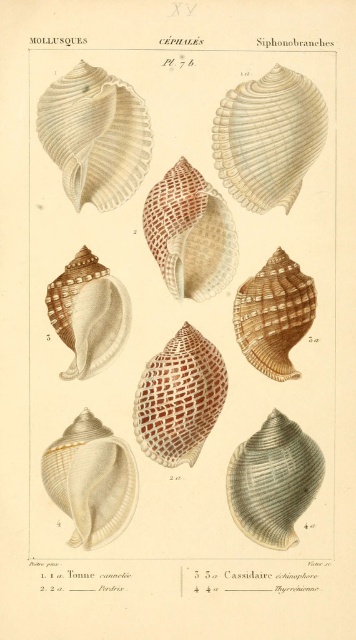
Question: Among these points, which one is nearest to the camera?

Choices:
 (A) (123, 292)
 (B) (274, 280)
 (C) (169, 376)
 (D) (306, 448)

Answer: (D)

Question: Is the position of brown woven shell at center more distant than that of matte brown shell at center-left?

Choices:
 (A) no
 (B) yes

Answer: (A)

Question: Does brown woven shell at center come behind matte beige shell at center-left?

Choices:
 (A) no
 (B) yes

Answer: (B)

Question: Among these objects, which one is nearest to the camera?

Choices:
 (A) brown textured shell at center
 (B) brown textured shell at upper center

Answer: (B)

Question: Which point is closer to the camera?

Choices:
 (A) matte brown shell at upper left
 (B) brown textured shell at center
 (C) brown striped shell at center

Answer: (A)

Question: Is matte brown shell at upper right to the left of brown striped shell at center from the viewer's perspective?

Choices:
 (A) yes
 (B) no

Answer: (A)